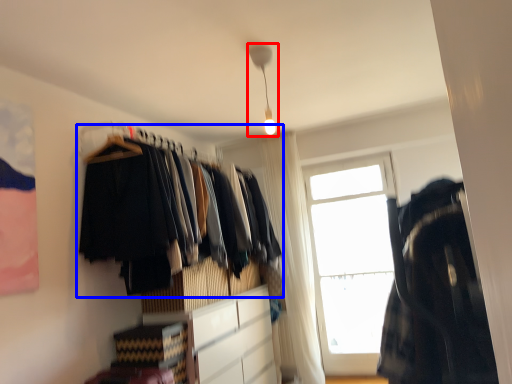
Question: Among these objects, which one is farthest to the camera, light fixture (highlighted by a red box) or closet (highlighted by a blue box)?

Choices:
 (A) light fixture
 (B) closet

Answer: (A)